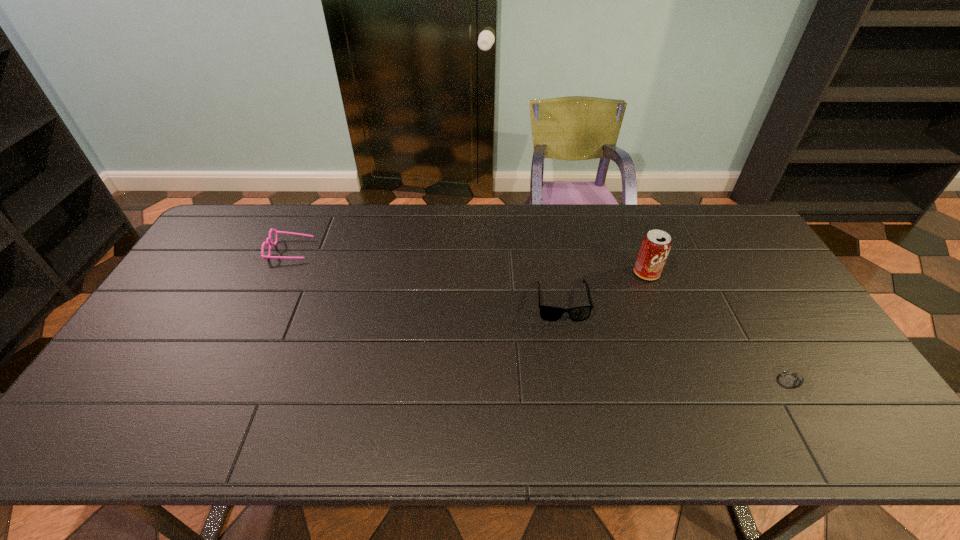
You are a GUI agent. You are given a task and a screenshot of the screen. Output one action in this format:
    pyautogui.click(x=<x>, y=<y>)
    Task: Click on the free space located 0.050m on the face of the watch
    
    Given the screenshot: What is the action you would take?
    pyautogui.click(x=814, y=416)

You are a GUI agent. You are given a task and a screenshot of the screen. Output one action in this format:
    pyautogui.click(x=<x>, y=<y>)
    Task: Click on the object present at the far edge
    
    Given the screenshot: What is the action you would take?
    pyautogui.click(x=268, y=240)

Find the location of `object present at the right edge`. object present at the right edge is located at coordinates (791, 379).

Where is `vacant space at the far edge`? This screenshot has width=960, height=540. vacant space at the far edge is located at coordinates (324, 230).

Where is `vacant space at the near edge of the desktop`? vacant space at the near edge of the desktop is located at coordinates (219, 442).

This screenshot has height=540, width=960. Identify the location of vacant space at the left edge. (166, 320).

The image size is (960, 540). I want to click on vacant position at the right edge of the desktop, so click(x=781, y=316).

Locate an element on the screen. This screenshot has width=960, height=540. vacant area at the far left corner of the desktop is located at coordinates (223, 225).

At what (x,y) coordinates should I click in order to perform the action: click on vacant area at the far right corner of the desktop. Please return your answer as a coordinate pair (x, y). This screenshot has height=540, width=960. Looking at the image, I should click on (728, 238).

I want to click on empty space that is in between the sunglasses and the farthest object, so click(x=426, y=276).